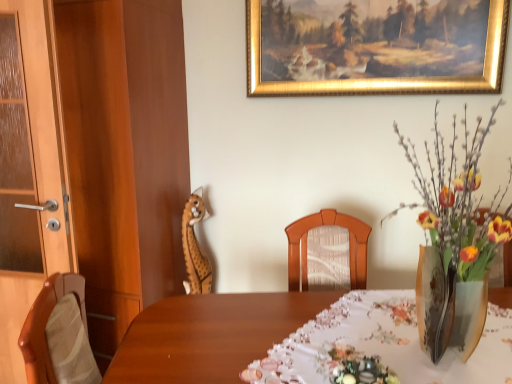
Question: Considering the relative positions of translucent glass vase at right and wooden door at left in the image provided, is translucent glass vase at right to the left of wooden door at left from the viewer's perspective?

Choices:
 (A) no
 (B) yes

Answer: (A)

Question: From a real-world perspective, is translucent glass vase at right on top of wooden door at left?

Choices:
 (A) no
 (B) yes

Answer: (B)

Question: Would you say translucent glass vase at right contains wooden door at left?

Choices:
 (A) no
 (B) yes

Answer: (A)

Question: Is translucent glass vase at right thinner than wooden door at left?

Choices:
 (A) no
 (B) yes

Answer: (A)

Question: Is translucent glass vase at right placed right next to wooden door at left?

Choices:
 (A) yes
 (B) no

Answer: (B)

Question: Relative to gold-framed painting at upper center, is wooden door at left in front or behind?

Choices:
 (A) behind
 (B) front

Answer: (B)

Question: Is wooden door at left inside the boundaries of gold-framed painting at upper center, or outside?

Choices:
 (A) outside
 (B) inside

Answer: (A)

Question: From a real-world perspective, relative to gold-framed painting at upper center, is wooden door at left vertically above or below?

Choices:
 (A) below
 (B) above

Answer: (A)

Question: Considering the positions of point (9, 334) and point (471, 64), is point (9, 334) closer or farther from the camera than point (471, 64)?

Choices:
 (A) farther
 (B) closer

Answer: (A)

Question: From the image's perspective, is translucent glass vase at right located above or below wooden door at left?

Choices:
 (A) below
 (B) above

Answer: (B)

Question: Is translucent glass vase at right wider or thinner than wooden door at left?

Choices:
 (A) wide
 (B) thin

Answer: (A)

Question: From a real-world perspective, relative to wooden door at left, is translucent glass vase at right vertically above or below?

Choices:
 (A) above
 (B) below

Answer: (A)

Question: In the image, is translucent glass vase at right on the left side or the right side of wooden door at left?

Choices:
 (A) left
 (B) right

Answer: (B)

Question: From the image's perspective, relative to translucent glass vase at right, is wooden door at left above or below?

Choices:
 (A) below
 (B) above

Answer: (A)

Question: Looking at their shapes, would you say wooden door at left is wider or thinner than translucent glass vase at right?

Choices:
 (A) thin
 (B) wide

Answer: (A)